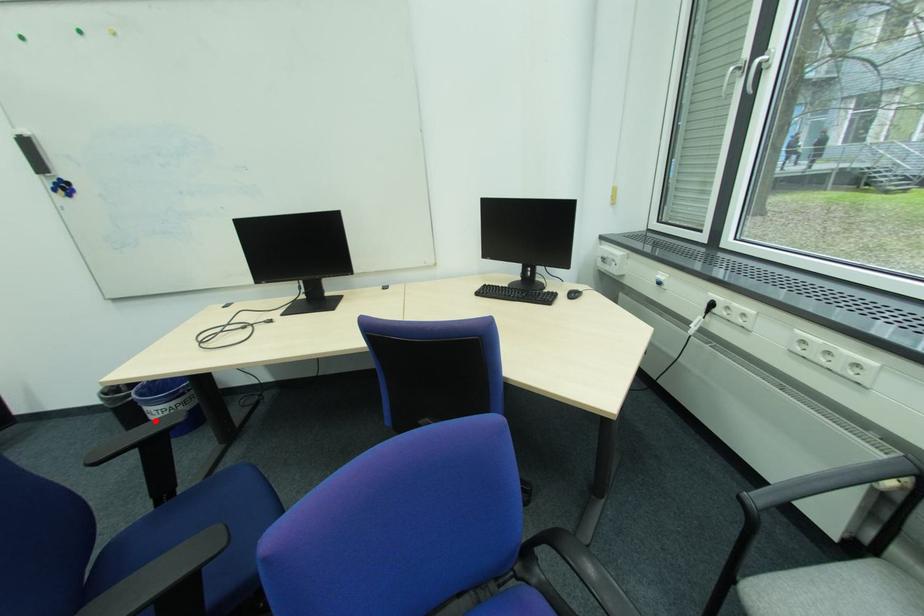
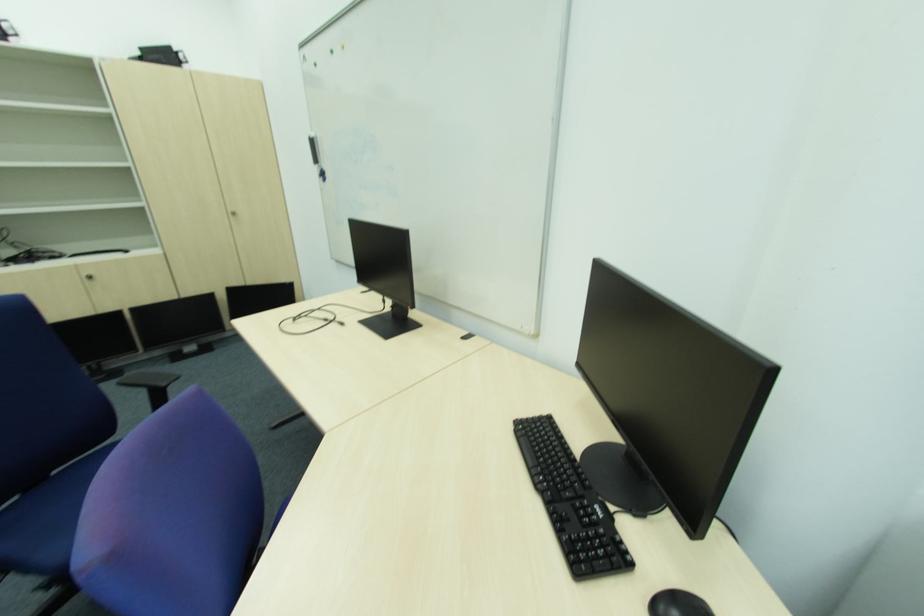
Question: I am providing you with two images of the same scene from different viewpoints. A red point is marked on the first image. Can you still see the location of the red point in image 2?

Choices:
 (A) Yes
 (B) No

Answer: (B)